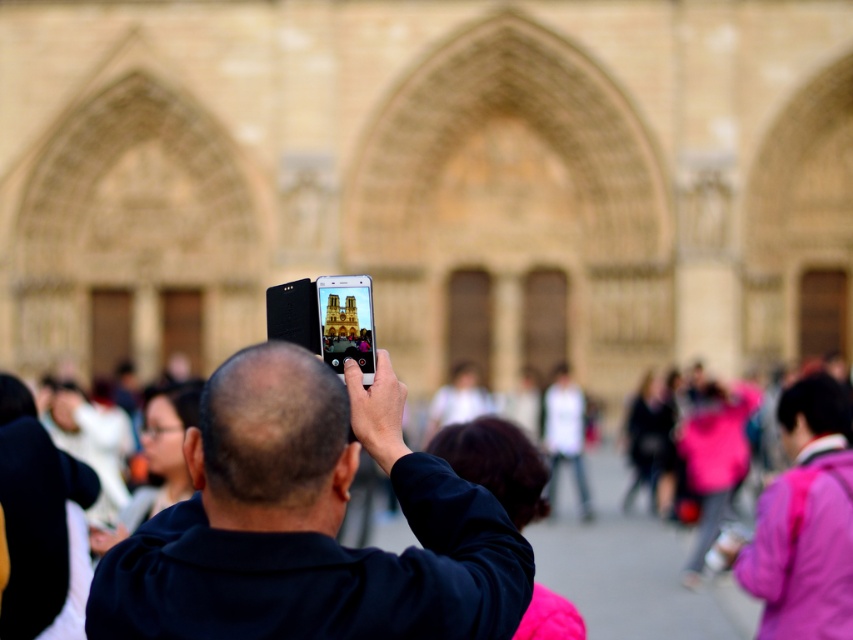
Can you confirm if dark blue fabric jacket at center is thinner than black matte smartphone at center?

No.

Is point (285, 372) more distant than point (357, 333)?

That is False.

Find the location of a particular element. Image resolution: width=853 pixels, height=640 pixels. dark blue fabric jacket at center is located at coordinates (308, 524).